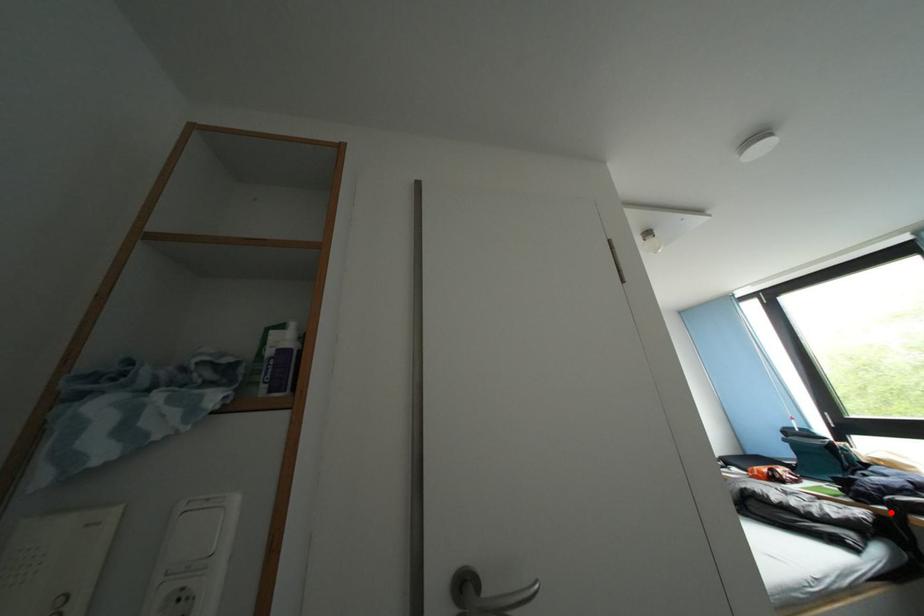
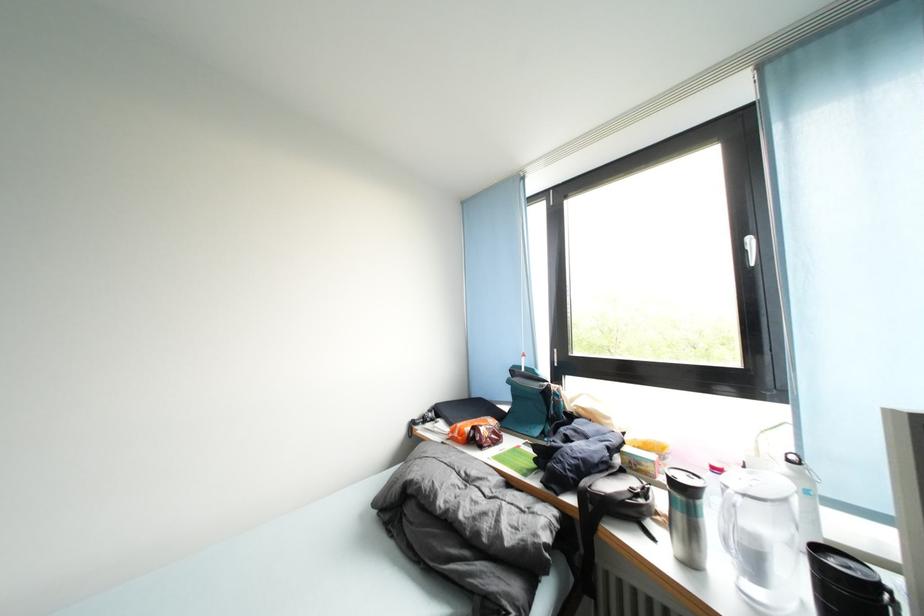
Question: A red point is marked in image1. In image2, is the corresponding 3D point closer to the camera or farther? Reply with the corresponding letter.

Choices:
 (A) The corresponding 3D point is closer.
 (B) The corresponding 3D point is farther.

Answer: (B)